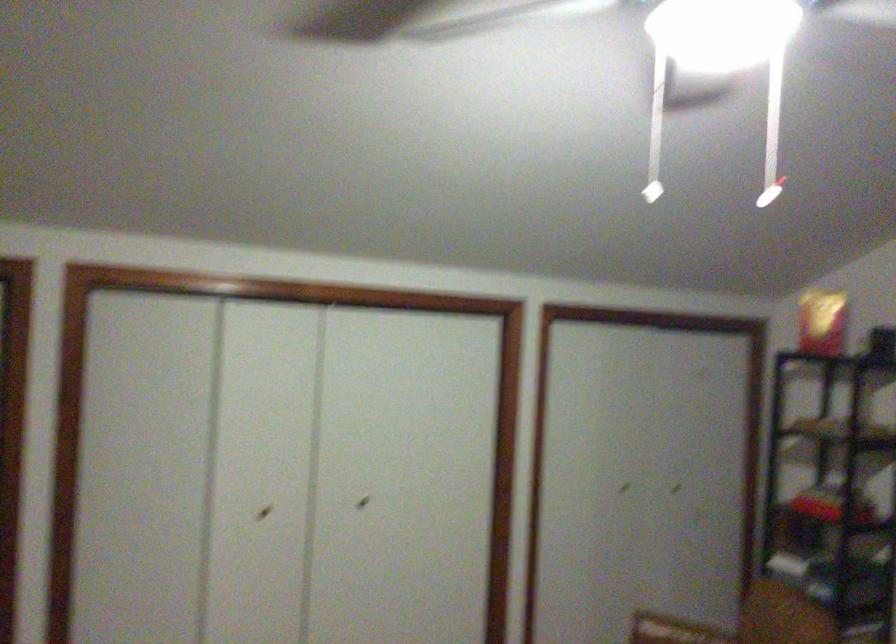
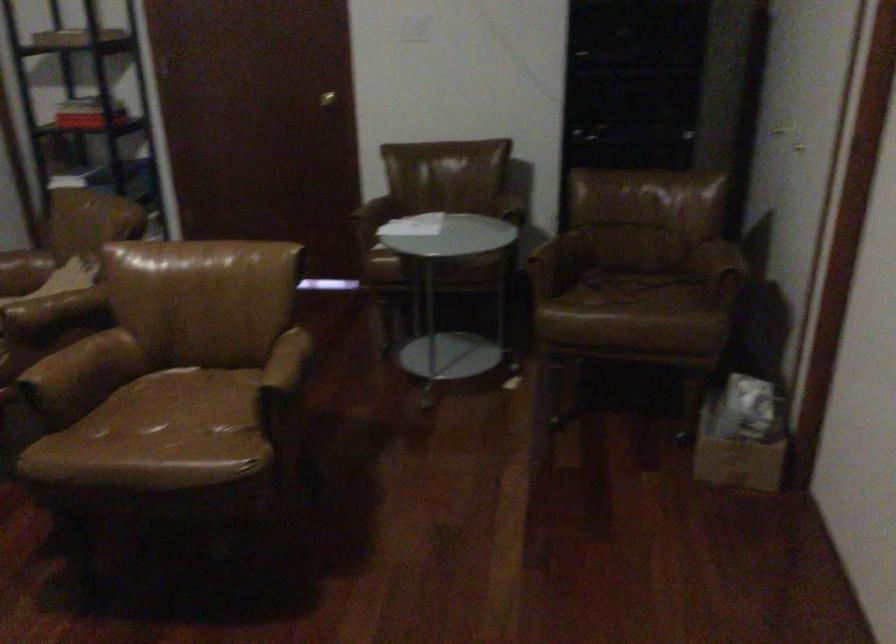
First-person continuous shooting, in which direction is the camera rotating?

The camera rotated toward right-down.